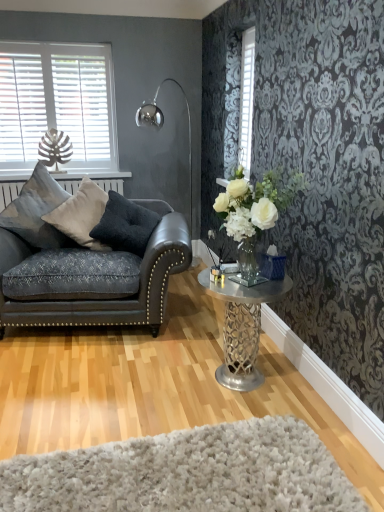
Question: Is metallic silver table at center wider than dark gray velvet pillow at left, which is the 1th pillow in right-to-left order?

Choices:
 (A) no
 (B) yes

Answer: (B)

Question: Considering the relative positions of metallic silver table at center and dark gray velvet pillow at left, marked as the 3th pillow in a left-to-right arrangement, in the image provided, is metallic silver table at center to the left of dark gray velvet pillow at left, marked as the 3th pillow in a left-to-right arrangement, from the viewer's perspective?

Choices:
 (A) yes
 (B) no

Answer: (B)

Question: Is metallic silver table at center facing towards dark gray velvet pillow at left, which is the 1th pillow in right-to-left order?

Choices:
 (A) no
 (B) yes

Answer: (A)

Question: Does metallic silver table at center have a lesser width compared to dark gray velvet pillow at left, which is the 1th pillow in right-to-left order?

Choices:
 (A) yes
 (B) no

Answer: (B)

Question: Can you see metallic silver table at center touching dark gray velvet pillow at left, marked as the 3th pillow in a left-to-right arrangement?

Choices:
 (A) yes
 (B) no

Answer: (B)

Question: Is velvet cushion at left, placed as the first pillow when sorted from left to right, inside the boundaries of metallic silver table at center, or outside?

Choices:
 (A) inside
 (B) outside

Answer: (B)

Question: Considering the positions of velvet cushion at left, placed as the first pillow when sorted from left to right, and metallic silver table at center in the image, is velvet cushion at left, placed as the first pillow when sorted from left to right, taller or shorter than metallic silver table at center?

Choices:
 (A) short
 (B) tall

Answer: (B)

Question: Does point (26, 211) appear closer or farther from the camera than point (241, 384)?

Choices:
 (A) farther
 (B) closer

Answer: (A)

Question: Would you say velvet cushion at left, placed as the first pillow when sorted from left to right, is to the left or to the right of metallic silver table at center in the picture?

Choices:
 (A) left
 (B) right

Answer: (A)

Question: From their relative heights in the image, would you say dark gray velvet pillow at left, marked as the 3th pillow in a left-to-right arrangement, is taller or shorter than white wood blinds at upper left, the second window viewed from the right?

Choices:
 (A) tall
 (B) short

Answer: (B)

Question: In terms of width, does dark gray velvet pillow at left, marked as the 3th pillow in a left-to-right arrangement, look wider or thinner when compared to white wood blinds at upper left, which appears as the first window when viewed from the back?

Choices:
 (A) wide
 (B) thin

Answer: (A)

Question: From a real-world perspective, is dark gray velvet pillow at left, marked as the 3th pillow in a left-to-right arrangement, positioned above or below white wood blinds at upper left, which appears as the first window when viewed from the back?

Choices:
 (A) below
 (B) above

Answer: (A)

Question: Based on their positions, is dark gray velvet pillow at left, which is the 1th pillow in right-to-left order, located to the left or right of white wood blinds at upper left, which appears as the first window when viewed from the back?

Choices:
 (A) left
 (B) right

Answer: (B)

Question: Visually, is velvet cushion at left, which appears as the 3th pillow when viewed from the right, positioned to the left or to the right of metallic silver floor lamp at upper left?

Choices:
 (A) left
 (B) right

Answer: (A)

Question: Is velvet cushion at left, placed as the first pillow when sorted from left to right, inside the boundaries of metallic silver floor lamp at upper left, or outside?

Choices:
 (A) outside
 (B) inside

Answer: (A)